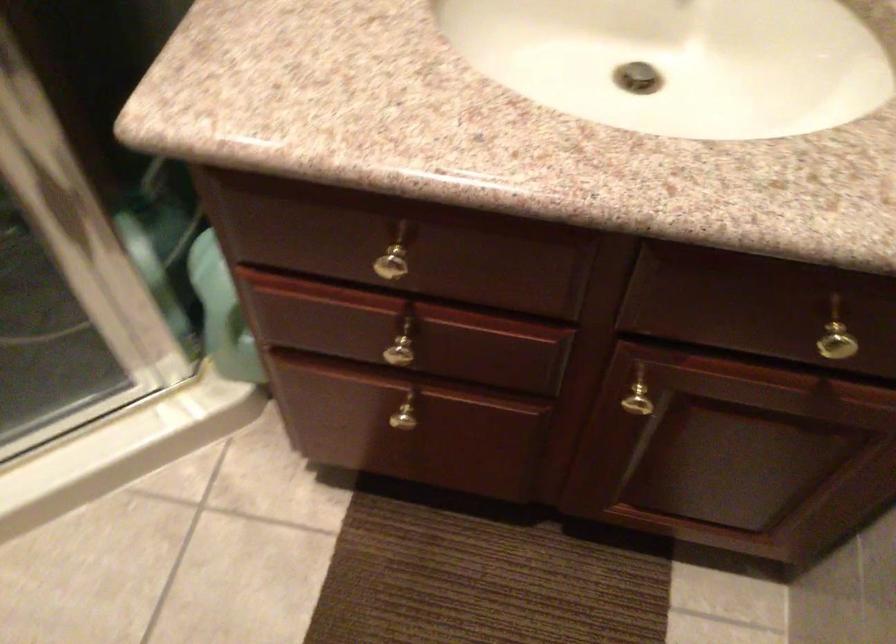
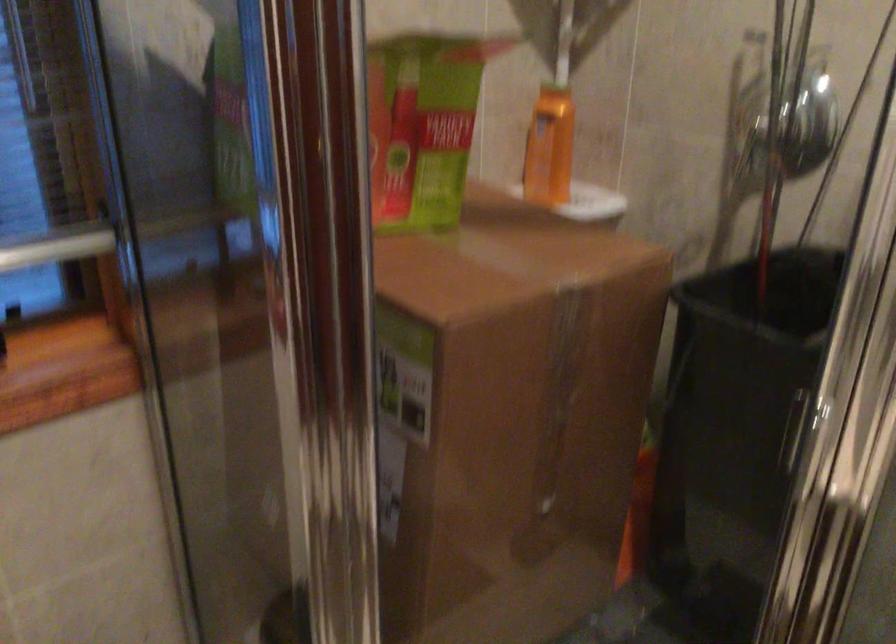
The first image is from the beginning of the video and the second image is from the end. How did the camera likely rotate when shooting the video?

The rotation direction of the camera is left-up.